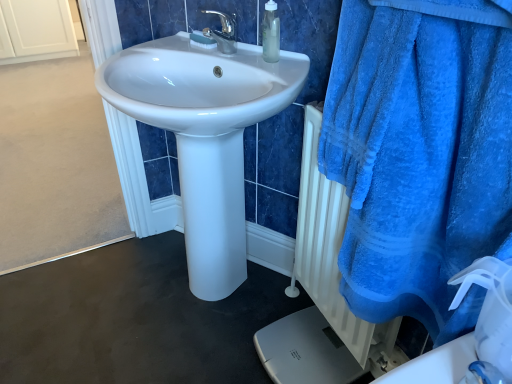
Find the location of `blue plush towel at right`. blue plush towel at right is located at coordinates (420, 153).

In order to face silver metallic scale at lower right, should I rotate leftwards or rightwards?

To align with it, rotate right about 6.904°.

At what (x,y) coordinates should I click in order to perform the action: click on white textured radiator at lower right. Please return your answer as a coordinate pair (x, y). The width and height of the screenshot is (512, 384). Looking at the image, I should click on [x=332, y=257].

The image size is (512, 384). Identify the location of white glossy sink at center. (205, 136).

Describe the element at coordinates (271, 33) in the screenshot. This screenshot has height=384, width=512. I see `translucent plastic bottle at upper center` at that location.

The image size is (512, 384). I want to click on blue plush towel at right, so click(x=420, y=153).

Is white glossy sink at center shorter than silver metallic scale at lower right?

In fact, white glossy sink at center may be taller than silver metallic scale at lower right.

Is white glossy sink at center wider or thinner than silver metallic scale at lower right?

In the image, white glossy sink at center appears to be wider than silver metallic scale at lower right.

Between point (279, 62) and point (333, 343), which one is positioned behind?

The point (333, 343) is more distant.

Are white glossy sink at center and silver metallic scale at lower right making contact?

No.

From a real-world perspective, relative to white plastic brush at upper center, is white glossy sink at center vertically above or below?

Clearly, from a real-world perspective, white glossy sink at center is below white plastic brush at upper center.

Is white glossy sink at center behind white plastic brush at upper center?

No, white glossy sink at center is closer to the camera.

Is white glossy sink at center turned away from white plastic brush at upper center?

Yes.

Who is smaller, white glossy sink at center or white plastic brush at upper center?

With smaller size is white plastic brush at upper center.

Could you tell me if white glossy sink at center is facing white textured radiator at lower right?

No, white glossy sink at center is not oriented towards white textured radiator at lower right.

Considering the relative positions of white glossy sink at center and white textured radiator at lower right in the image provided, is white glossy sink at center behind white textured radiator at lower right?

That is False.

Considering the sizes of objects white glossy sink at center and white textured radiator at lower right in the image provided, who is thinner, white glossy sink at center or white textured radiator at lower right?

Thinner between the two is white textured radiator at lower right.

Consider the image. Is white glossy sink at center positioned far away from white textured radiator at lower right?

They are positioned close to each other.

Which is more to the left, silver metallic scale at lower right or blue plush towel at right?

silver metallic scale at lower right is more to the left.

Would you say silver metallic scale at lower right is outside blue plush towel at right?

That's correct, silver metallic scale at lower right is outside of blue plush towel at right.

From the image's perspective, is silver metallic scale at lower right positioned above or below blue plush towel at right?

Clearly, from the image's perspective, silver metallic scale at lower right is below blue plush towel at right.

From a real-world perspective, which is physically above, silver metallic scale at lower right or blue plush towel at right?

blue plush towel at right.

Where is `soap dispenser on the right of white plastic brush at upper center`? This screenshot has height=384, width=512. soap dispenser on the right of white plastic brush at upper center is located at coordinates (271, 33).

Looking at their sizes, would you say translucent plastic bottle at upper center is wider or thinner than white plastic brush at upper center?

Clearly, translucent plastic bottle at upper center has more width compared to white plastic brush at upper center.

Is translucent plastic bottle at upper center located outside white plastic brush at upper center?

translucent plastic bottle at upper center lies outside white plastic brush at upper center's area.

Looking at this image, from the image's perspective, is silver metallic scale at lower right over white glossy sink at center?

Actually, silver metallic scale at lower right appears below white glossy sink at center in the image.

From a real-world perspective, does silver metallic scale at lower right sit lower than white glossy sink at center?

Yes.

In the image, is silver metallic scale at lower right on the left side or the right side of white glossy sink at center?

silver metallic scale at lower right is to the right of white glossy sink at center.

Consider the image. Considering the positions of objects silver metallic scale at lower right and white textured radiator at lower right in the image provided, who is more to the right, silver metallic scale at lower right or white textured radiator at lower right?

From the viewer's perspective, white textured radiator at lower right appears more on the right side.

Can you tell me how much silver metallic scale at lower right and white textured radiator at lower right differ in facing direction?

There is a 0.000331-degree angle between the facing directions of silver metallic scale at lower right and white textured radiator at lower right.

Is silver metallic scale at lower right inside or outside of white textured radiator at lower right?

silver metallic scale at lower right is outside white textured radiator at lower right.

In the image, is silver metallic scale at lower right positioned in front of or behind white textured radiator at lower right?

In the image, silver metallic scale at lower right appears behind white textured radiator at lower right.

At what (x,y) coordinates should I click in order to perform the action: click on porcelain below the white glossy sink at center (from the image's perspective). Please return your answer as a coordinate pair (x, y). Looking at the image, I should click on (306, 351).

Where is `soap on the right of white glossy sink at center`? The height and width of the screenshot is (384, 512). soap on the right of white glossy sink at center is located at coordinates (202, 40).

Looking at the image, which one is located closer to blue plush towel at right, translucent plastic bottle at upper center or white plastic brush at upper center?

translucent plastic bottle at upper center lies closer to blue plush towel at right than the other object.

From the image, which object appears to be farther from silver metallic scale at lower right, translucent plastic bottle at upper center or white plastic brush at upper center?

white plastic brush at upper center lies further to silver metallic scale at lower right than the other object.

Estimate the real-world distances between objects in this image. Which object is further from translucent plastic bottle at upper center, silver metallic scale at lower right or white glossy sink at center?

silver metallic scale at lower right is positioned further to the anchor translucent plastic bottle at upper center.

From the image, which object appears to be farther from white glossy sink at center, silver metallic scale at lower right or white textured radiator at lower right?

The object further to white glossy sink at center is silver metallic scale at lower right.

From the picture: Based on their spatial positions, is blue plush towel at right or white textured radiator at lower right closer to silver metallic scale at lower right?

white textured radiator at lower right.

Based on their spatial positions, is silver metallic scale at lower right or blue plush towel at right closer to white plastic brush at upper center?

blue plush towel at right lies closer to white plastic brush at upper center than the other object.

Looking at the image, which one is located closer to blue plush towel at right, silver metallic scale at lower right or white plastic brush at upper center?

The object closer to blue plush towel at right is silver metallic scale at lower right.

Based on their spatial positions, is white glossy sink at center or silver metallic scale at lower right further from white textured radiator at lower right?

The object further to white textured radiator at lower right is white glossy sink at center.

Locate an element on the screen. The width and height of the screenshot is (512, 384). radiator situated between white glossy sink at center and blue plush towel at right from left to right is located at coordinates (332, 257).

Locate an element on the screen. soap dispenser between white plastic brush at upper center and silver metallic scale at lower right in the vertical direction is located at coordinates click(x=271, y=33).

You are a GUI agent. You are given a task and a screenshot of the screen. Output one action in this format:
    pyautogui.click(x=<x>, y=<y>)
    Task: Click on the bath towel between white plastic brush at upper center and silver metallic scale at lower right vertically
    This screenshot has height=384, width=512.
    Given the screenshot: What is the action you would take?
    pyautogui.click(x=420, y=153)

This screenshot has width=512, height=384. In order to click on soap dispenser between blue plush towel at right and white plastic brush at upper center along the z-axis in this screenshot , I will do `click(271, 33)`.